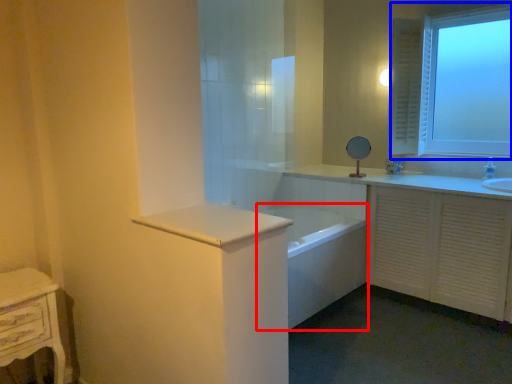
Question: Which of the following is the closest to the observer, bath (highlighted by a red box) or window (highlighted by a blue box)?

Choices:
 (A) bath
 (B) window

Answer: (A)